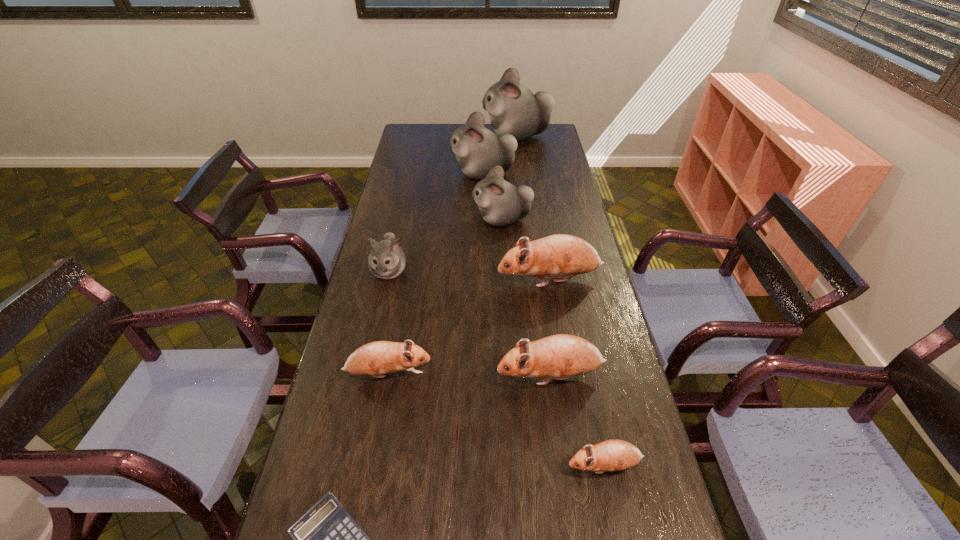
The width and height of the screenshot is (960, 540). Identify the location of vacant space that's between the seventh tallest object and the farthest brown hamster. (468, 327).

I want to click on free space between the nearest hamster and the second farthest white hamster, so click(x=543, y=320).

At what (x,y) coordinates should I click in order to perform the action: click on free space between the second biggest brown hamster and the seventh nearest object. Please return your answer as a coordinate pair (x, y). Image resolution: width=960 pixels, height=540 pixels. Looking at the image, I should click on (526, 298).

Identify the location of free point between the nearest brown hamster and the third smallest white hamster. (543, 320).

What are the coordinates of `free space between the third farthest object and the third smallest brown hamster` in the screenshot? It's located at (526, 298).

This screenshot has width=960, height=540. What are the coordinates of `empty space that is in between the third shortest object and the seventh nearest object` in the screenshot? It's located at (444, 297).

This screenshot has width=960, height=540. I want to click on vacant space in between the nearest hamster and the smallest white hamster, so click(496, 368).

Locate an element on the screen. This screenshot has width=960, height=540. vacant space that is in between the second nearest object and the second biggest brown hamster is located at coordinates click(x=577, y=421).

Identify which object is the sixth closest to the nearest hamster. Please provide its 2D coordinates. Your answer should be formatted as a tuple, i.e. [(x, y)], where the tuple contains the x and y coordinates of a point satisfying the conditions above.

[(500, 203)]

Identify which object is the fifth nearest to the second tallest hamster. Please provide its 2D coordinates. Your answer should be formatted as a tuple, i.e. [(x, y)], where the tuple contains the x and y coordinates of a point satisfying the conditions above.

[(562, 356)]